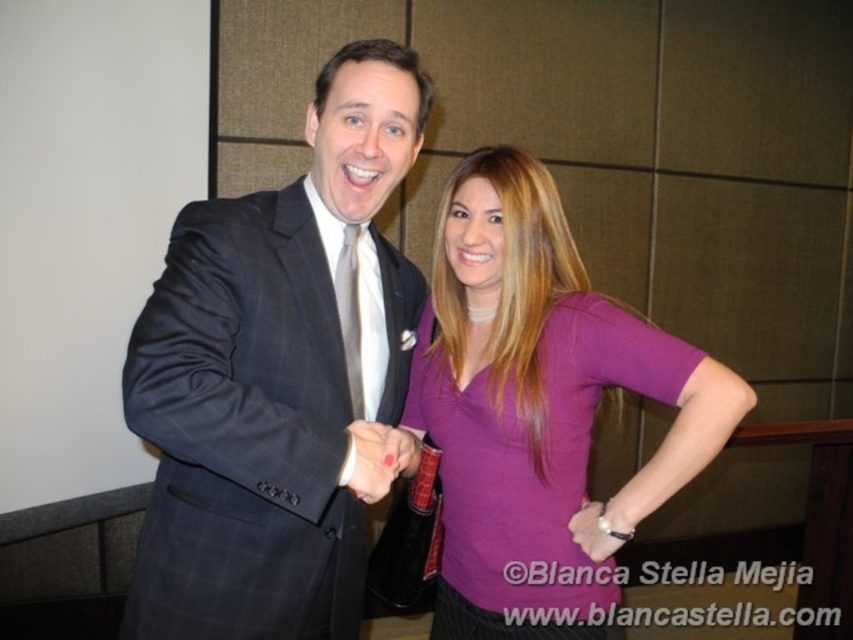
Which is behind, point (465, 545) or point (587, 515)?

The point (465, 545) is more distant.

Where is `matte black suit at center`? The width and height of the screenshot is (853, 640). matte black suit at center is located at coordinates (537, 406).

Who is more distant from viewer, (155, 481) or (628, 532)?

The point (628, 532) is more distant.

Identify the location of matte black suit at center. The image size is (853, 640). (537, 406).

Does point (544, 628) lie behind point (381, 472)?

Yes, it is behind point (381, 472).

What do you see at coordinates (537, 406) in the screenshot? I see `purple matte shirt at center` at bounding box center [537, 406].

This screenshot has height=640, width=853. In order to click on purple matte shirt at center in this screenshot , I will do `click(537, 406)`.

This screenshot has width=853, height=640. What do you see at coordinates (380, 458) in the screenshot?
I see `matte black hand at center` at bounding box center [380, 458].

Is point (372, 433) closer to camera compared to point (354, 284)?

Yes, it is in front of point (354, 284).

Does point (403, 433) lie behind point (358, 362)?

No, (403, 433) is in front of (358, 362).

What are the coordinates of `matte black hand at center` in the screenshot? It's located at (380, 458).